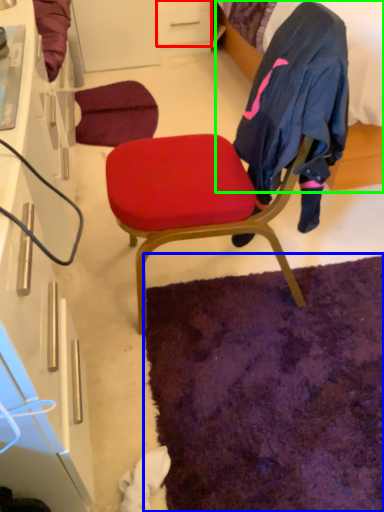
Question: Which is farther away from drawer (highlighted by a red box)? mat (highlighted by a blue box) or bed (highlighted by a green box)?

Choices:
 (A) mat
 (B) bed

Answer: (A)